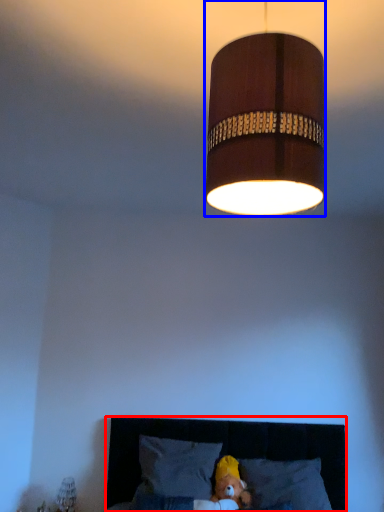
Question: Which of the following is the farthest to the observer, furniture (highlighted by a red box) or lamp (highlighted by a blue box)?

Choices:
 (A) furniture
 (B) lamp

Answer: (A)